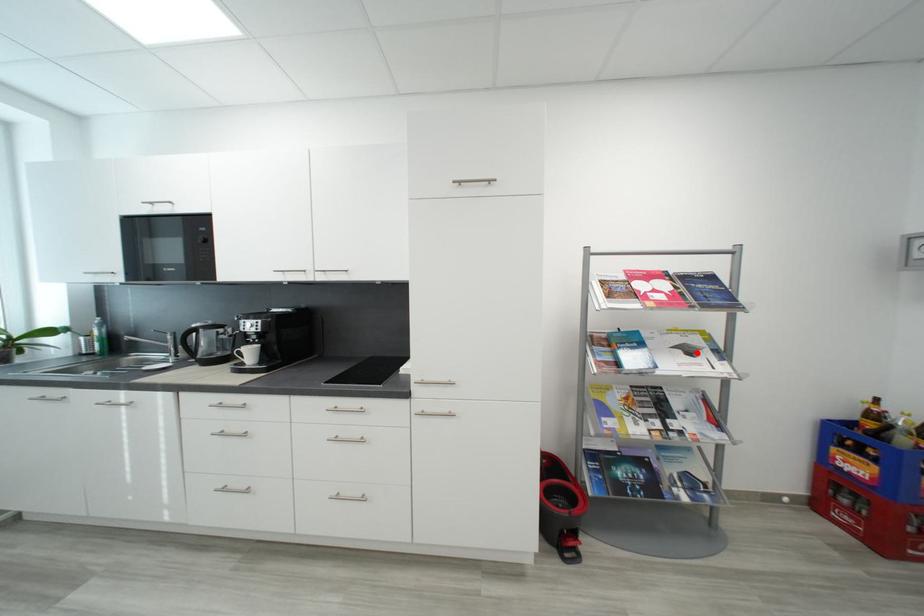
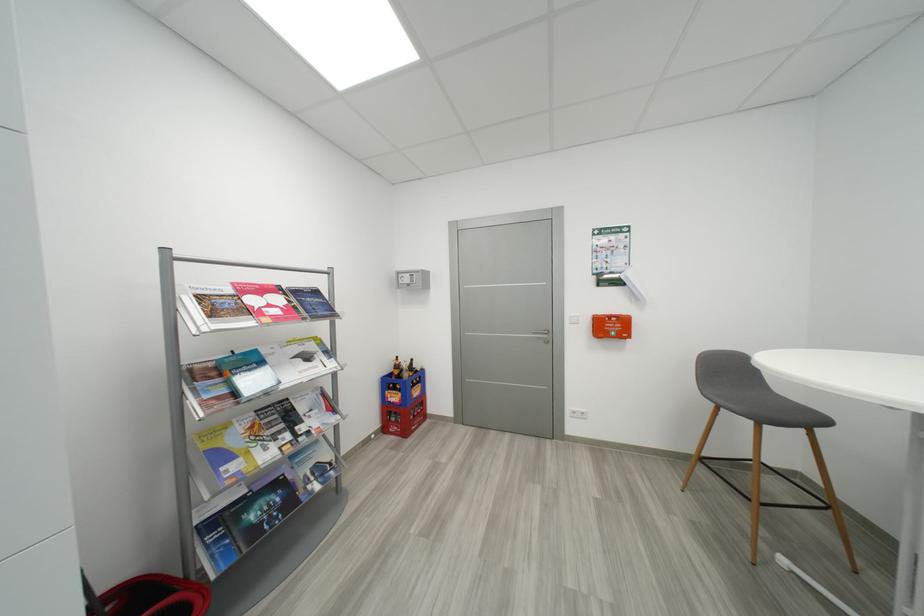
The point at the highlighted location is marked in the first image. Where is the corresponding point in the second image?

(314, 359)